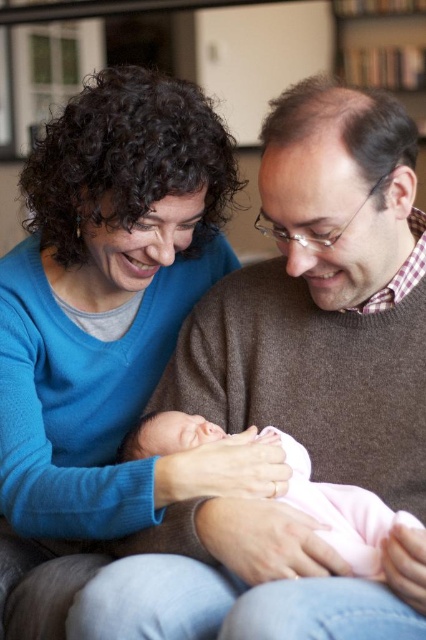
You are a photographer setting up a studio shoot. You need to position a light source so that it illuminates both the blue sweater at upper left and the pink soft fabric newborn at center. Considering their heights, where should you place the light to ensure both are well lit?

The blue sweater at upper left is much taller than the pink soft fabric newborn at center, so placing the light source above both objects will ensure that the light reaches both effectively, illuminating the taller blue sweater and the shorter newborn equally.

You are an interior designer assessing the space in the image. You need to determine if the brown sweater at center can be placed on a shelf in the wooden bookshelf at upper center. What should you consider about their sizes?

The brown sweater at center has a smaller size compared to the wooden bookshelf at upper center, so it can fit on one of the shelves if the shelf space is appropriately sized.

You are a photographer standing in front of the wooden bookshelf at upper center and want to take a photo of the pink soft fabric newborn at center. Which object should you focus on first to ensure the newborn is in focus?

You should focus on the pink soft fabric newborn at center first because it is closer to you than the wooden bookshelf at upper center.